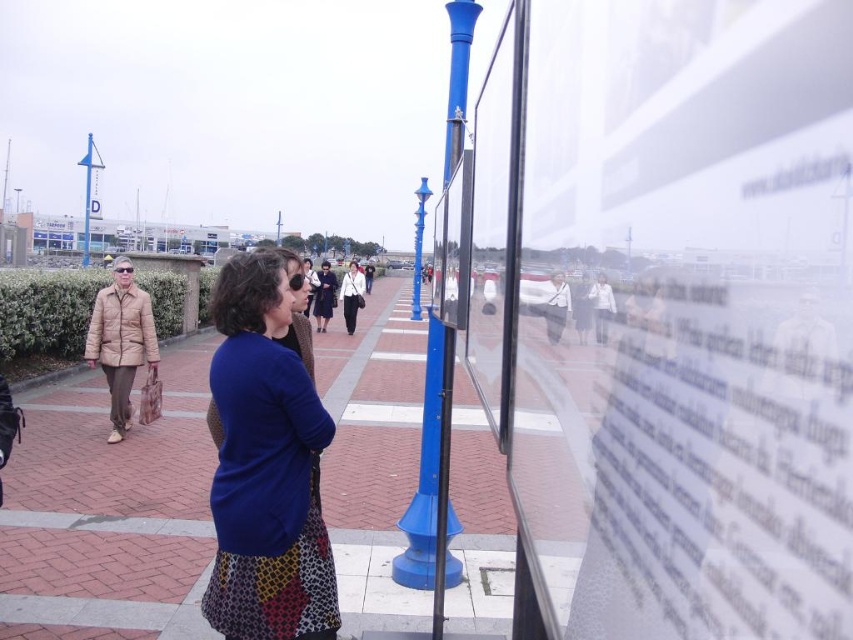
Question: Which point is farther to the camera?

Choices:
 (A) brick pavement at center
 (B) blue fabric skirt at center

Answer: (B)

Question: Does brick pavement at center appear on the right side of green leafy hedge at left?

Choices:
 (A) no
 (B) yes

Answer: (B)

Question: In this image, where is blue fabric skirt at center located relative to green leafy hedge at left?

Choices:
 (A) below
 (B) above

Answer: (A)

Question: Which point is farther to the camera?

Choices:
 (A) (373, 356)
 (B) (300, 396)

Answer: (A)

Question: Which of the following is the closest to the observer?

Choices:
 (A) (177, 442)
 (B) (68, 317)
 (C) (300, 378)

Answer: (C)

Question: In this image, where is brick pavement at center located relative to green leafy hedge at left?

Choices:
 (A) left
 (B) right

Answer: (B)